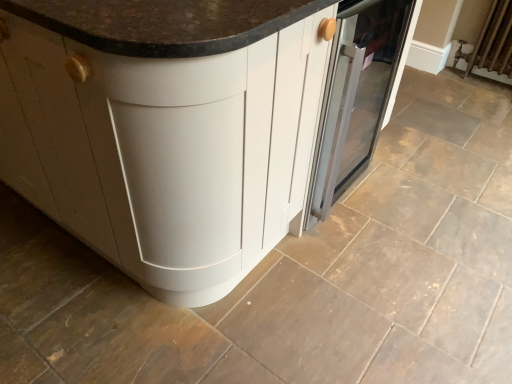
Question: Does white matte cabinet at center appear on the right side of brown fabric radiator at upper right?

Choices:
 (A) no
 (B) yes

Answer: (A)

Question: Does white matte cabinet at center have a lesser height compared to brown fabric radiator at upper right?

Choices:
 (A) no
 (B) yes

Answer: (A)

Question: Is white matte cabinet at center facing away from brown fabric radiator at upper right?

Choices:
 (A) no
 (B) yes

Answer: (A)

Question: From a real-world perspective, is white matte cabinet at center under brown fabric radiator at upper right?

Choices:
 (A) no
 (B) yes

Answer: (A)

Question: Could you tell me if white matte cabinet at center is turned towards brown fabric radiator at upper right?

Choices:
 (A) yes
 (B) no

Answer: (B)

Question: Can you confirm if white matte cabinet at center is taller than brown fabric radiator at upper right?

Choices:
 (A) yes
 (B) no

Answer: (A)

Question: From a real-world perspective, is satin silver oven at center over brown fabric radiator at upper right?

Choices:
 (A) no
 (B) yes

Answer: (B)

Question: Is satin silver oven at center at the right side of brown fabric radiator at upper right?

Choices:
 (A) no
 (B) yes

Answer: (A)

Question: Could brown fabric radiator at upper right be considered to be inside satin silver oven at center?

Choices:
 (A) no
 (B) yes

Answer: (A)

Question: Is satin silver oven at center with brown fabric radiator at upper right?

Choices:
 (A) yes
 (B) no

Answer: (B)

Question: Is satin silver oven at center positioned in front of brown fabric radiator at upper right?

Choices:
 (A) no
 (B) yes

Answer: (B)

Question: From a real-world perspective, is satin silver oven at center located beneath brown fabric radiator at upper right?

Choices:
 (A) no
 (B) yes

Answer: (A)

Question: Considering the relative positions of white matte cabinet at center and satin silver oven at center in the image provided, is white matte cabinet at center behind satin silver oven at center?

Choices:
 (A) no
 (B) yes

Answer: (A)